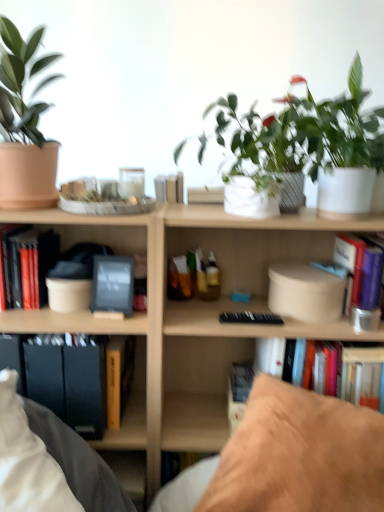
Question: Is white matte flowerpot at center wider or thinner than brown suede pillow at lower right?

Choices:
 (A) thin
 (B) wide

Answer: (A)

Question: Considering the positions of point (246, 201) and point (269, 448), is point (246, 201) closer or farther from the camera than point (269, 448)?

Choices:
 (A) farther
 (B) closer

Answer: (A)

Question: Which object is positioned farthest from the white matte flowerpot at center?

Choices:
 (A) green matte plant at upper right, the 2th houseplant when ordered from left to right
 (B) hardcover book at left, which ranks as the third paperback book in right-to-left order
 (C) wooden bookcase at center
 (D) hardcover book at lower left, which ranks as the 2th paperback book in right-to-left order
 (E) brown suede pillow at lower right

Answer: (B)

Question: Estimate the real-world distances between objects in this image. Which object is closer to the hardcover book at left, which ranks as the third paperback book in right-to-left order?

Choices:
 (A) matte black folders at lower left
 (B) matte terracotta pot at left, which is the second houseplant in right-to-left order
 (C) brown suede pillow at lower right
 (D) green matte plant at upper right, arranged as the first houseplant when viewed from the right
 (E) hardcover book at left, the first book from the left

Answer: (E)